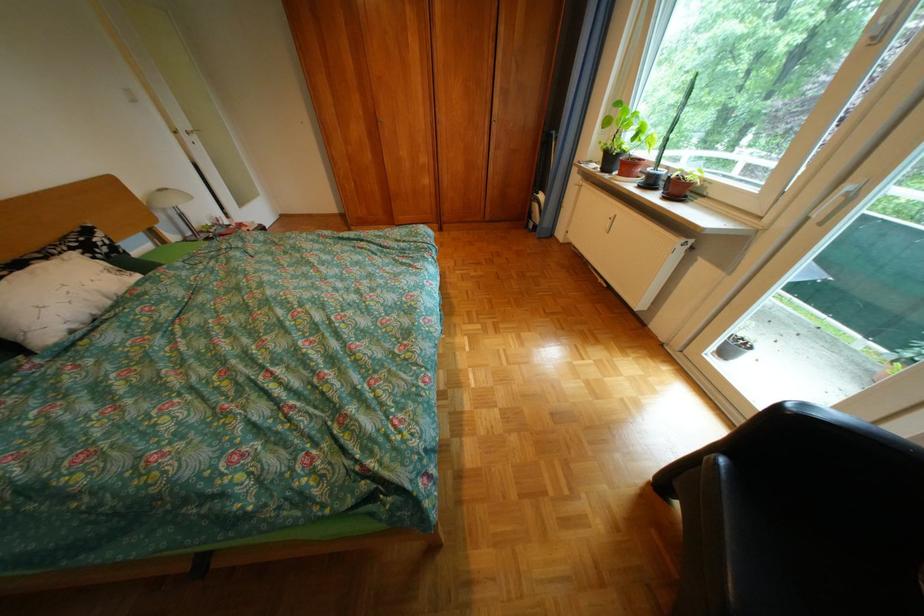
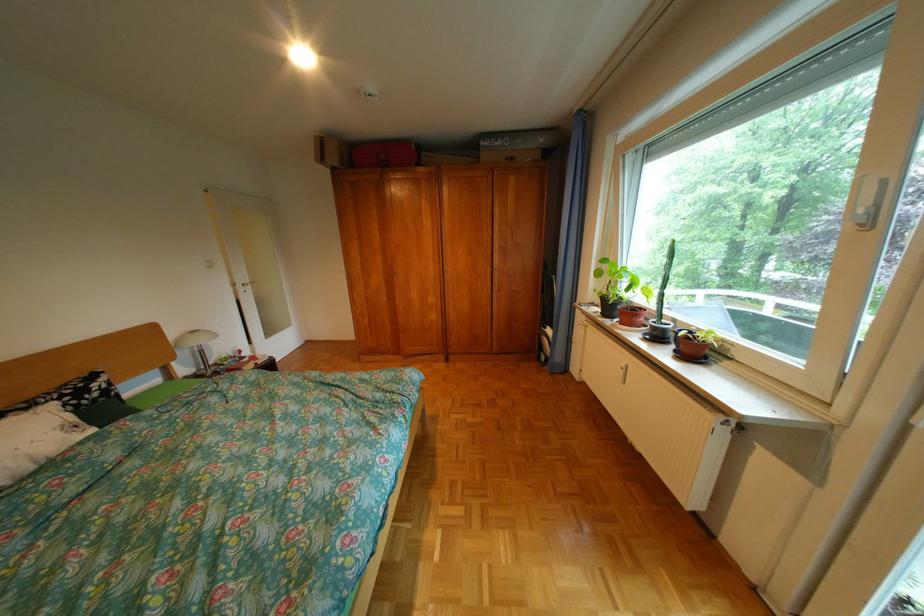
In the second image, find the point that corresponds to (634,175) in the first image.

(636, 323)